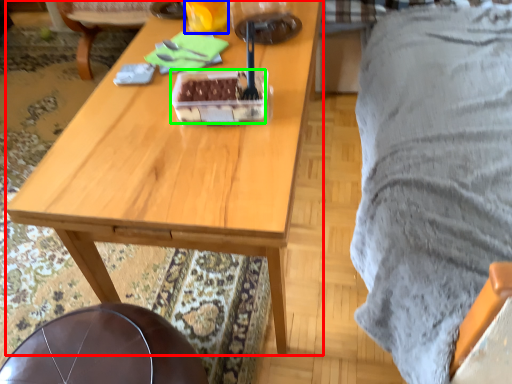
Question: Estimate the real-world distances between objects in this image. Which object is closer to desk (highlighted by a red box), coffee cup (highlighted by a blue box) or food (highlighted by a green box)?

Choices:
 (A) coffee cup
 (B) food

Answer: (B)